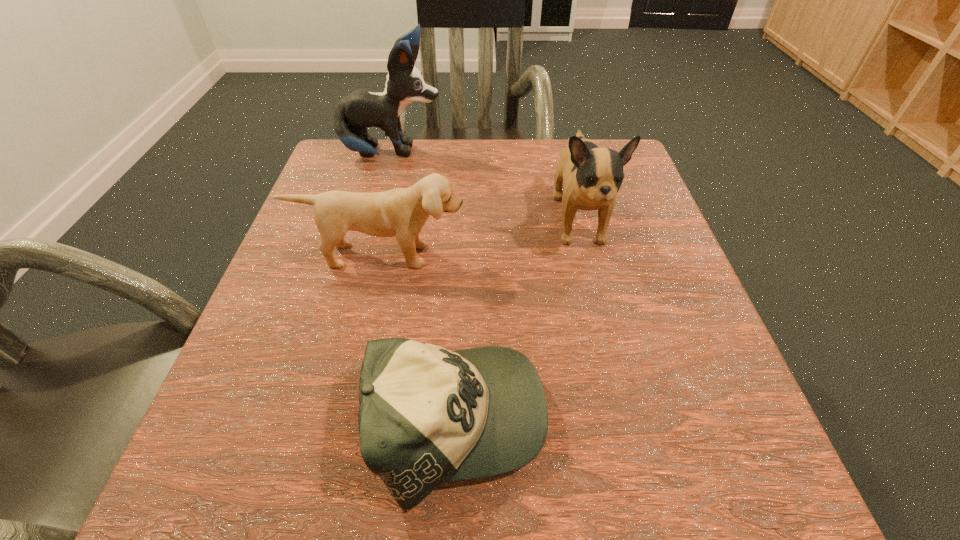
Locate an element on the screen. free spot located on the front-facing side of the nearest object is located at coordinates (695, 422).

Find the location of `object located at the near edge`. object located at the near edge is located at coordinates (427, 415).

Find the location of `object positioned at the right edge`. object positioned at the right edge is located at coordinates (592, 175).

In order to click on object that is positioned at the far left corner in this screenshot , I will do `click(363, 108)`.

At what (x,y) coordinates should I click in order to perform the action: click on object situated at the far right corner. Please return your answer as a coordinate pair (x, y). The width and height of the screenshot is (960, 540). Looking at the image, I should click on (592, 175).

The height and width of the screenshot is (540, 960). In the image, there is a desktop. In order to click on vacant space at the far edge in this screenshot , I will do `click(472, 148)`.

In the image, there is a desktop. At what (x,y) coordinates should I click in order to perform the action: click on vacant area at the near edge. Please return your answer as a coordinate pair (x, y). The image size is (960, 540). Looking at the image, I should click on pyautogui.click(x=460, y=494).

Where is `free spot at the left edge of the desktop`? free spot at the left edge of the desktop is located at coordinates (257, 318).

You are a GUI agent. You are given a task and a screenshot of the screen. Output one action in this format:
    pyautogui.click(x=<x>, y=<y>)
    Task: Click on the blank area at the right edge
    The width and height of the screenshot is (960, 540).
    Given the screenshot: What is the action you would take?
    pyautogui.click(x=737, y=415)

Where is `vacant space at the near left corner of the desktop`? This screenshot has width=960, height=540. vacant space at the near left corner of the desktop is located at coordinates (248, 492).